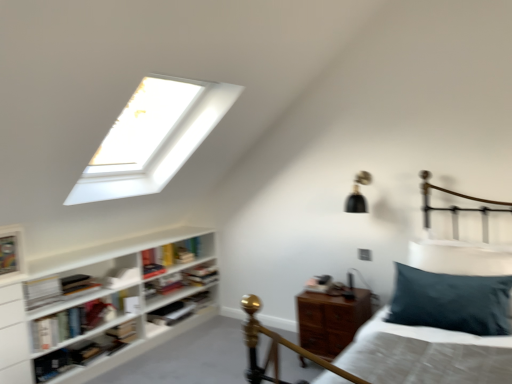
Question: Is wooden nightstand at lower right positioned before white matte bookshelf at lower left, which is the 3th book in front-to-back order?

Choices:
 (A) no
 (B) yes

Answer: (B)

Question: From the image's perspective, is wooden nightstand at lower right located beneath white matte bookshelf at lower left, the sixth book viewed from the back?

Choices:
 (A) no
 (B) yes

Answer: (B)

Question: Does wooden nightstand at lower right contain white matte bookshelf at lower left, the sixth book viewed from the back?

Choices:
 (A) no
 (B) yes

Answer: (A)

Question: Is wooden nightstand at lower right at the right side of white matte bookshelf at lower left, the sixth book viewed from the back?

Choices:
 (A) no
 (B) yes

Answer: (B)

Question: From a real-world perspective, is wooden nightstand at lower right beneath white matte bookshelf at lower left, which is the 3th book in front-to-back order?

Choices:
 (A) yes
 (B) no

Answer: (A)

Question: Considering their positions, is hardcover book at left, placed as the eighth book when sorted from back to front, located in front of or behind hardcover book at lower left, the fifth book in the back-to-front sequence?

Choices:
 (A) front
 (B) behind

Answer: (A)

Question: From the image's perspective, relative to hardcover book at lower left, which is the 4th book from front to back, is hardcover book at left, which ranks as the first book in front-to-back order, above or below?

Choices:
 (A) below
 (B) above

Answer: (B)

Question: From a real-world perspective, is hardcover book at left, placed as the eighth book when sorted from back to front, physically located above or below hardcover book at lower left, which is the 4th book from front to back?

Choices:
 (A) above
 (B) below

Answer: (A)

Question: Would you say hardcover book at left, which ranks as the first book in front-to-back order, is to the left or to the right of hardcover book at lower left, the fifth book in the back-to-front sequence, in the picture?

Choices:
 (A) right
 (B) left

Answer: (B)

Question: Considering the positions of hardcover book at center, arranged as the 2th book when viewed from the back, and hardcover book at center-left, which appears as the 4th book when viewed from the back, in the image, is hardcover book at center, arranged as the 2th book when viewed from the back, taller or shorter than hardcover book at center-left, which appears as the 4th book when viewed from the back,?

Choices:
 (A) short
 (B) tall

Answer: (B)

Question: Choose the correct answer: Is hardcover book at center, which is counted as the seventh book, starting from the front, inside hardcover book at center-left, which ranks as the fifth book in front-to-back order, or outside it?

Choices:
 (A) outside
 (B) inside

Answer: (A)

Question: Looking at their shapes, would you say hardcover book at center, which is counted as the seventh book, starting from the front, is wider or thinner than hardcover book at center-left, which appears as the 4th book when viewed from the back?

Choices:
 (A) wide
 (B) thin

Answer: (B)

Question: In the image, is hardcover book at center, which is counted as the seventh book, starting from the front, on the left side or the right side of hardcover book at center-left, which appears as the 4th book when viewed from the back?

Choices:
 (A) right
 (B) left

Answer: (A)

Question: From the image's perspective, is hardcover book at center, the third book from the back, positioned above or below hardcover book at center, placed as the 8th book when sorted from front to back?

Choices:
 (A) below
 (B) above

Answer: (A)

Question: Is hardcover book at center, the third book from the back, wider or thinner than hardcover book at center, the 1th book positioned from the back?

Choices:
 (A) thin
 (B) wide

Answer: (A)